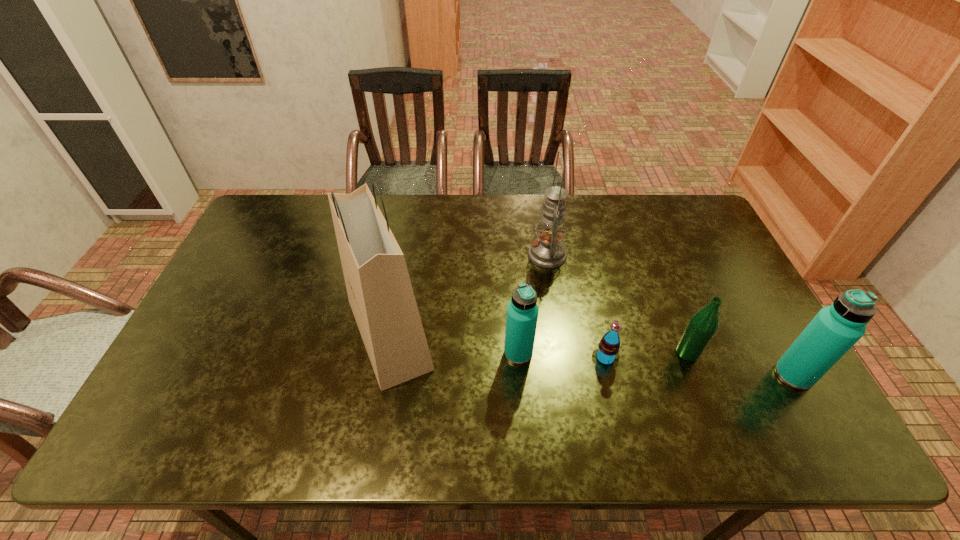
I want to click on the second object from left to right, so click(522, 311).

Locate an element on the screen. This screenshot has width=960, height=540. the shorter water bottle is located at coordinates click(x=522, y=311).

Locate an element on the screen. the rightmost object is located at coordinates (835, 329).

You are a GUI agent. You are given a task and a screenshot of the screen. Output one action in this format:
    pyautogui.click(x=<x>, y=<y>)
    Task: Click on the third tallest object
    
    Given the screenshot: What is the action you would take?
    pyautogui.click(x=835, y=329)

Where is `the farthest object`? Image resolution: width=960 pixels, height=540 pixels. the farthest object is located at coordinates (547, 251).

Identify the location of the second tallest object. (547, 251).

You are a GUI agent. You are given a task and a screenshot of the screen. Output one action in this format:
    pyautogui.click(x=<x>, y=<y>)
    Task: Click on the fifth object from left to right
    Image resolution: width=960 pixels, height=540 pixels.
    Given the screenshot: What is the action you would take?
    pyautogui.click(x=703, y=324)

This screenshot has height=540, width=960. I want to click on bottle, so click(703, 324).

At what (x,y) coordinates should I click in order to perform the action: click on the shortest object. Please return your answer as a coordinate pair (x, y). This screenshot has height=540, width=960. Looking at the image, I should click on (607, 352).

You are a GUI agent. You are given a task and a screenshot of the screen. Output one action in this format:
    pyautogui.click(x=<x>, y=<y>)
    Task: Click on the soda
    
    Given the screenshot: What is the action you would take?
    pyautogui.click(x=607, y=352)